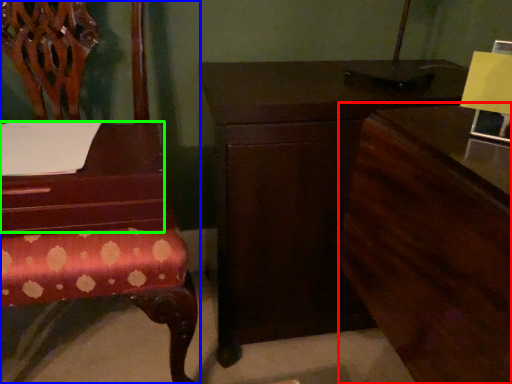
Question: Which object is positioned closest to dresser (highlighted by a red box)? Select from chair (highlighted by a blue box) and table (highlighted by a green box).

Choices:
 (A) chair
 (B) table

Answer: (B)